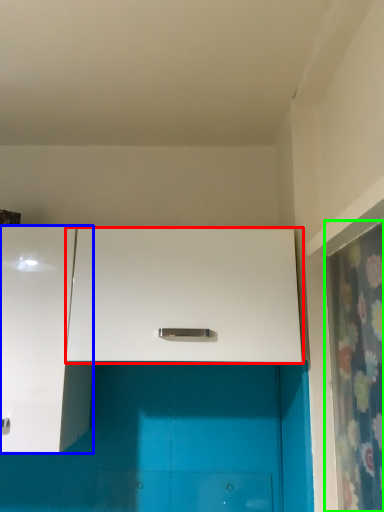
Question: Based on their relative distances, which object is nearer to cabinetry (highlighted by a red box)? Choose from cabinetry (highlighted by a blue box) and shower curtain (highlighted by a green box).

Choices:
 (A) cabinetry
 (B) shower curtain

Answer: (A)